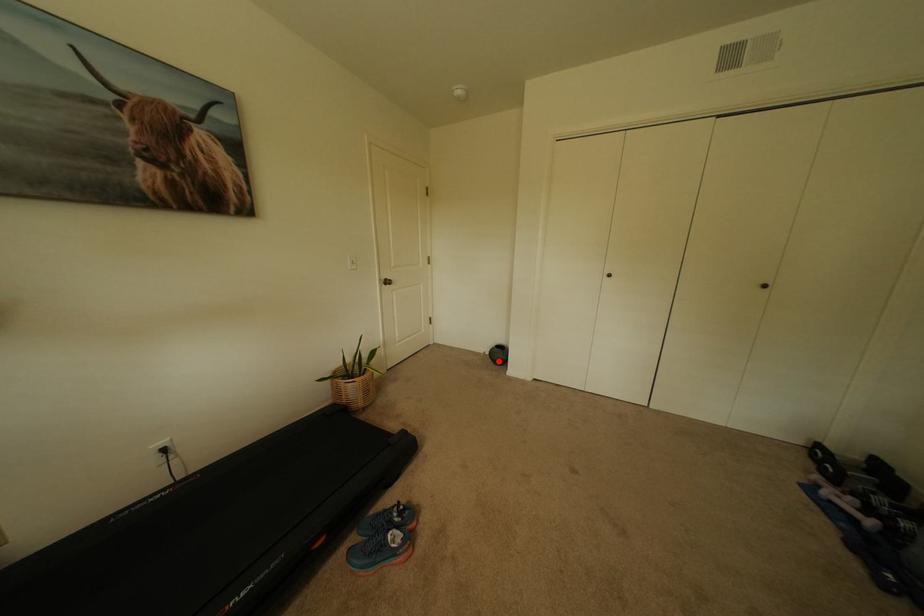
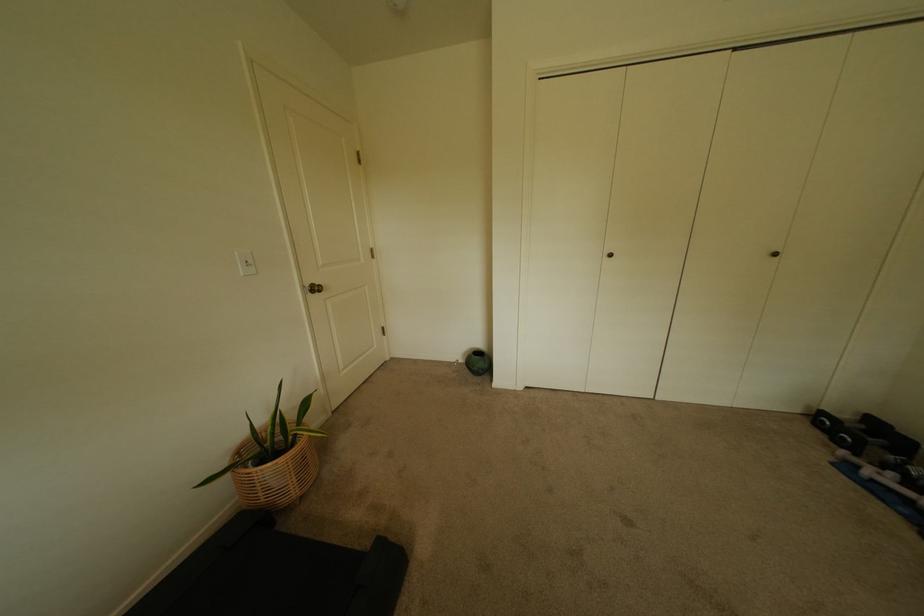
Find the pixel in the second image that matches the highlighted location in the first image.

(476, 371)